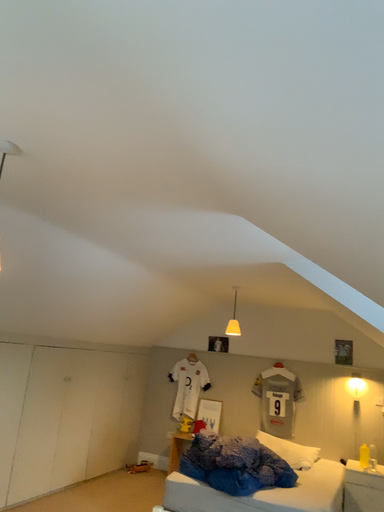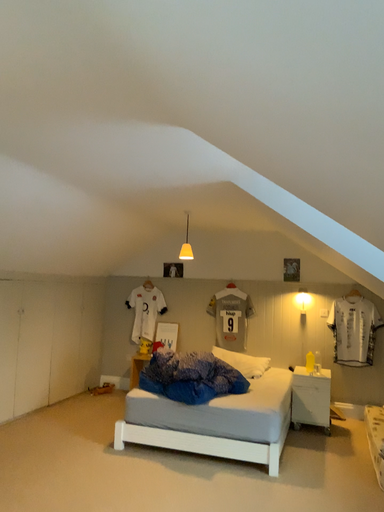
Question: How did the camera likely rotate when shooting the video?

Choices:
 (A) rotated left
 (B) rotated right

Answer: (B)